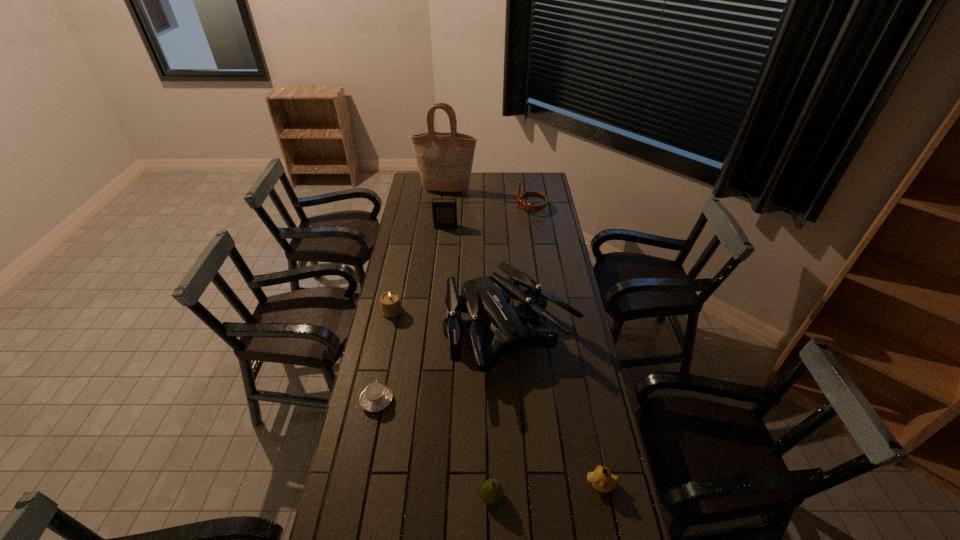
The image size is (960, 540). What are the coordinates of `object that is at the far left corner` in the screenshot? It's located at (444, 160).

In the image, there is a desktop. Where is `free space at the far edge`? free space at the far edge is located at coordinates (517, 177).

The image size is (960, 540). I want to click on vacant space at the left edge of the desktop, so click(364, 530).

Image resolution: width=960 pixels, height=540 pixels. In the image, there is a desktop. In order to click on vacant space at the right edge in this screenshot , I will do `click(535, 239)`.

Find the location of a particular element. The image size is (960, 540). vacant space at the far left corner is located at coordinates (419, 173).

The image size is (960, 540). I want to click on vacant space at the far right corner of the desktop, so click(523, 184).

Where is `empty space between the duckling and the pear`? This screenshot has width=960, height=540. empty space between the duckling and the pear is located at coordinates (546, 490).

The image size is (960, 540). I want to click on free space between the pear and the drone, so click(x=501, y=416).

What are the coordinates of `free space that is in between the drone and the pear` in the screenshot? It's located at (501, 416).

Where is `vacant point located between the drone and the pear`? The height and width of the screenshot is (540, 960). vacant point located between the drone and the pear is located at coordinates (501, 416).